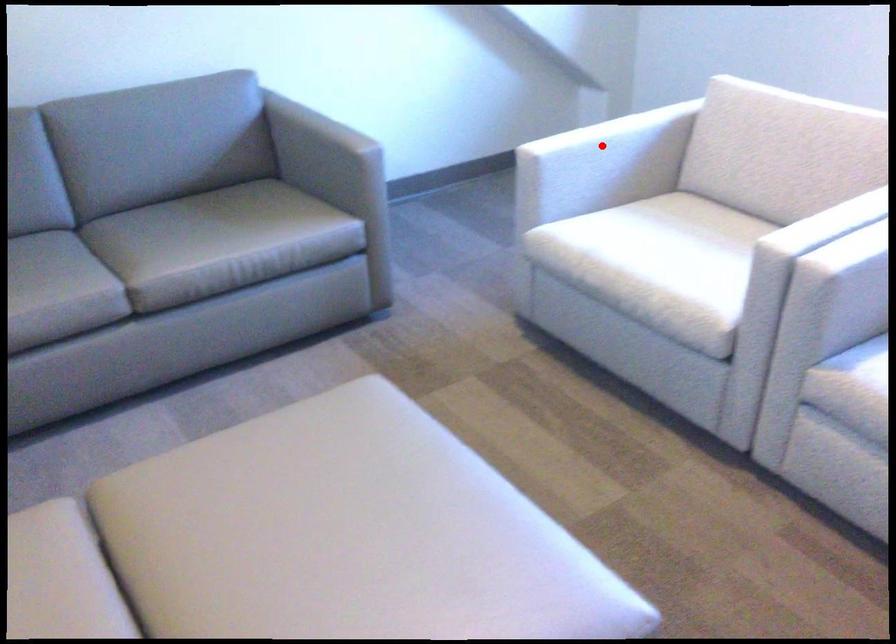
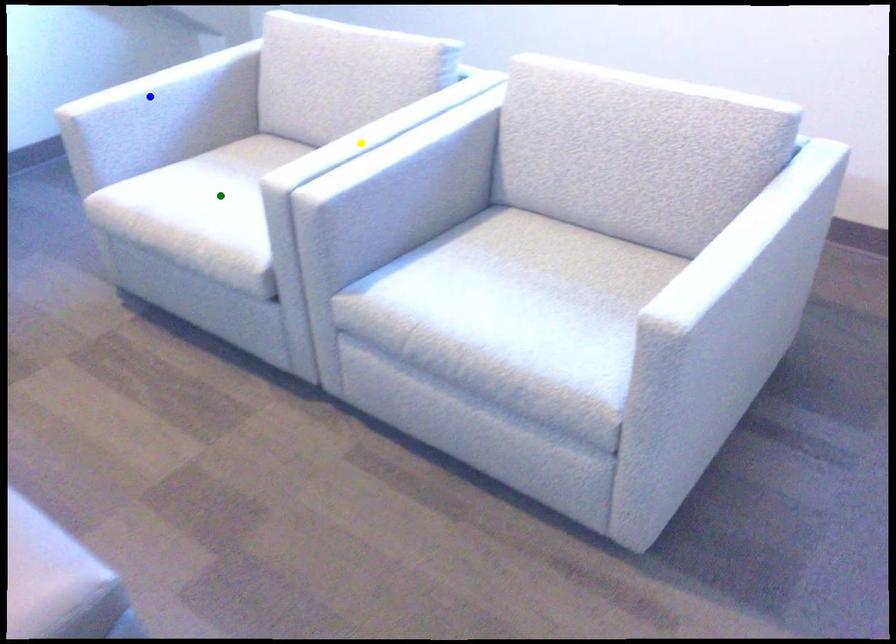
Question: I am providing you with two images of the same scene from different viewpoints. A red point is marked on the first image. You are given multiple points on the second image. Can you choose the point in image 2 that corresponds to the point in image 1?

Choices:
 (A) green point
 (B) blue point
 (C) yellow point

Answer: (B)